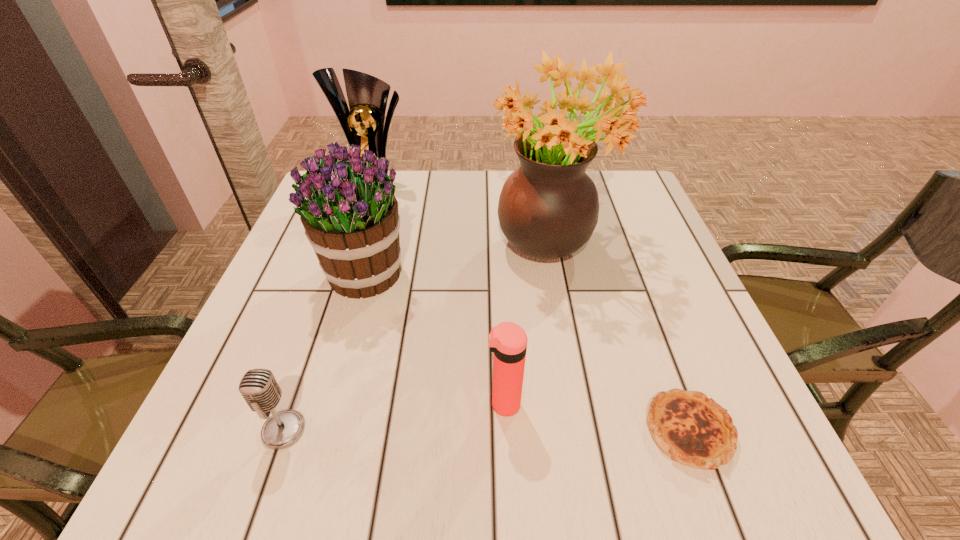
The width and height of the screenshot is (960, 540). I want to click on free space between the shortest object and the bouquet, so click(x=526, y=352).

At what (x,y) coordinates should I click in order to perform the action: click on the fifth closest object to the bouquet. Please return your answer as a coordinate pair (x, y). Looking at the image, I should click on (692, 429).

At what (x,y) coordinates should I click in order to perform the action: click on the second closest object relative to the award. Please return your answer as a coordinate pair (x, y). The width and height of the screenshot is (960, 540). Looking at the image, I should click on (548, 208).

The width and height of the screenshot is (960, 540). What are the coordinates of `free space that satisfies the following two spatial constraints: 1. at the front of the shortest object, where the globe is visible; 2. on the right side of the farthest object` in the screenshot? It's located at (298, 431).

Locate an element on the screen. This screenshot has width=960, height=540. free space that satisfies the following two spatial constraints: 1. at the front of the farthest object, where the globe is visible; 2. on the right side of the tallest object is located at coordinates (359, 241).

Identify the location of vacant region that satisfies the following two spatial constraints: 1. at the front of the farthest object, where the globe is visible; 2. on the right side of the quiche. click(298, 431).